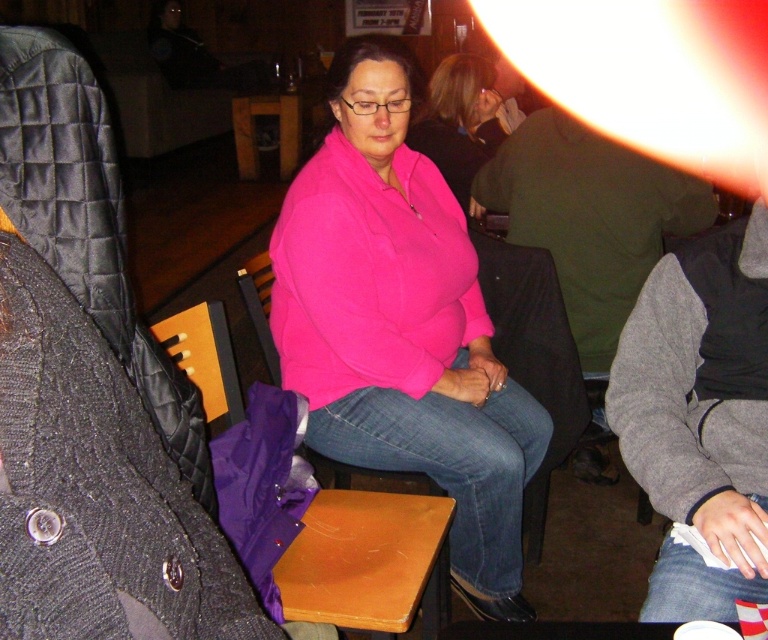
You are helping a customer at a clothing store who wants to know which item is wider between the pink fleece at center and the pink matte sweater at center. Can you determine which one is wider?

The pink fleece at center is wider than the pink matte sweater at center according to the description provided.

You are a photographer trying to capture a candid shot of the scene. You notice the pink fleece at center and the wooden chair at center. Which object should you focus on first to ensure it appears sharp in the photo?

The pink fleece at center is further to the viewer than the wooden chair at center, so you should focus on the pink fleece at center first to ensure it appears sharp.

You are a fashion designer observing the scene. You need to determine if the pink matte sweater at center can be folded and placed on the wooden table at center without overlapping the edges. Can it fit?

The pink matte sweater at center is thinner than the wooden table at center, so it can be folded and placed on the wooden table at center without overlapping the edges.